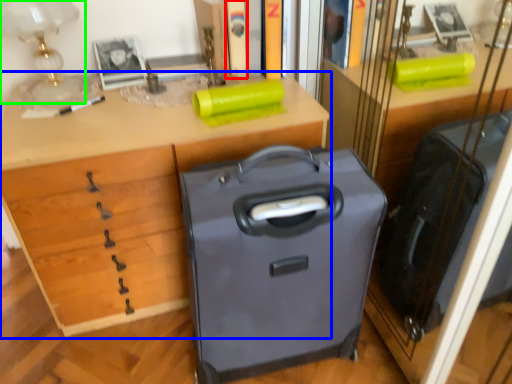
Question: Which object is the farthest from book (highlighted by a red box)? Choose among these: desk (highlighted by a blue box) or table lamp (highlighted by a green box).

Choices:
 (A) desk
 (B) table lamp

Answer: (A)